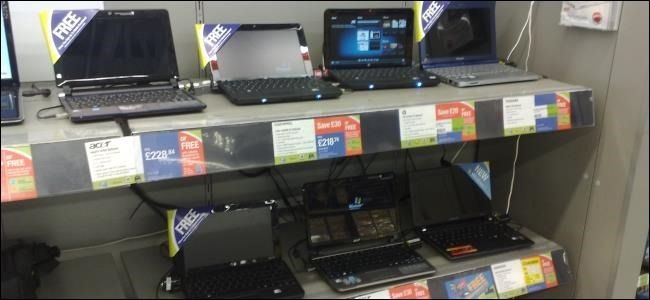
Identify the location of laptops. Image resolution: width=650 pixels, height=300 pixels. (121, 56), (273, 60), (366, 51), (463, 60), (446, 208), (354, 236), (248, 243), (17, 99).